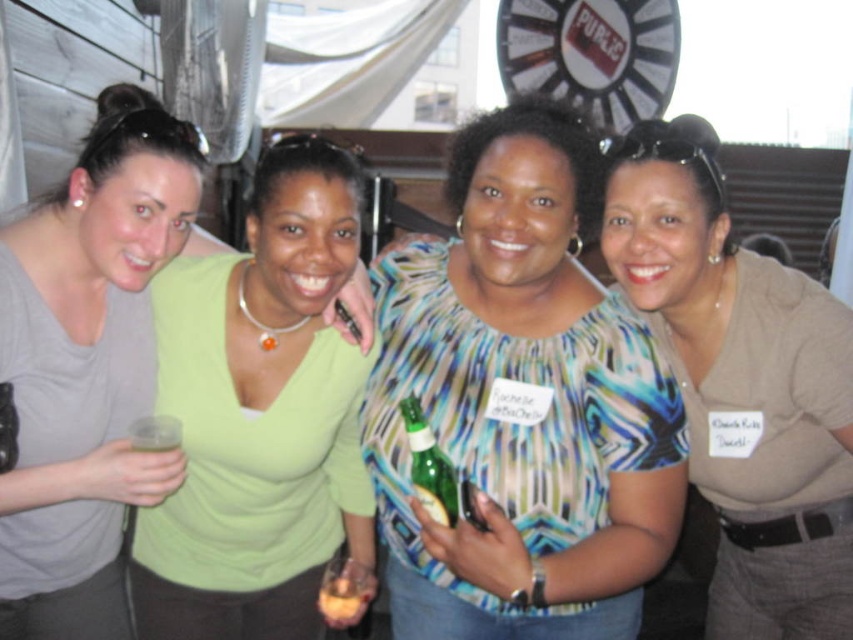
Question: Is brown matte shirt at center positioned before green glass bottle at center?

Choices:
 (A) yes
 (B) no

Answer: (B)

Question: Which point is farther to the camera?

Choices:
 (A) (196, 140)
 (B) (434, 516)
 (C) (200, 545)
 (D) (527, 296)

Answer: (C)

Question: Can you confirm if matte gray shirt at left is wider than translucent plastic cup at center?

Choices:
 (A) no
 (B) yes

Answer: (B)

Question: Among these objects, which one is nearest to the camera?

Choices:
 (A) matte gray shirt at left
 (B) brown matte shirt at center
 (C) translucent plastic cup at center
 (D) striped fabric blouse at center

Answer: (D)

Question: Is striped fabric blouse at center below matte gray shirt at left?

Choices:
 (A) yes
 (B) no

Answer: (B)

Question: Which object is the closest to the brown matte shirt at center?

Choices:
 (A) matte gray shirt at left
 (B) green glass bottle at center
 (C) striped fabric blouse at center

Answer: (C)